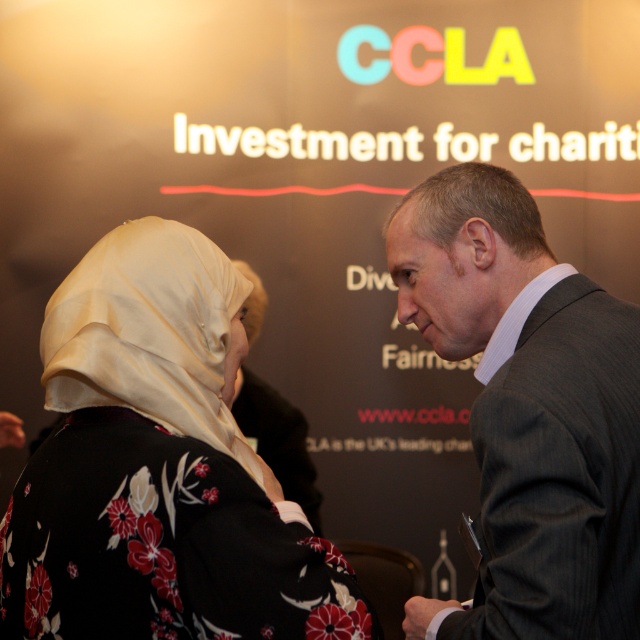
You are standing at the conference and want to take a photo of the two people talking. The first person is at point (64, 496) and the second is at point (534, 504). Which person should you focus on first to ensure they are in focus?

You should focus on the person at point (64, 496) first because they are closer to the camera than the person at point (534, 504).

You are attending a conference and want to approach the two people in the image. The person wearing the silky beige hijab at left is your target. Based on their spatial positioning, which direction should you move relative to the dark gray suit at right to reach them?

The silky beige hijab at left is below the dark gray suit at right, so to reach the silky beige hijab at left, you should move downward from the dark gray suit at right.